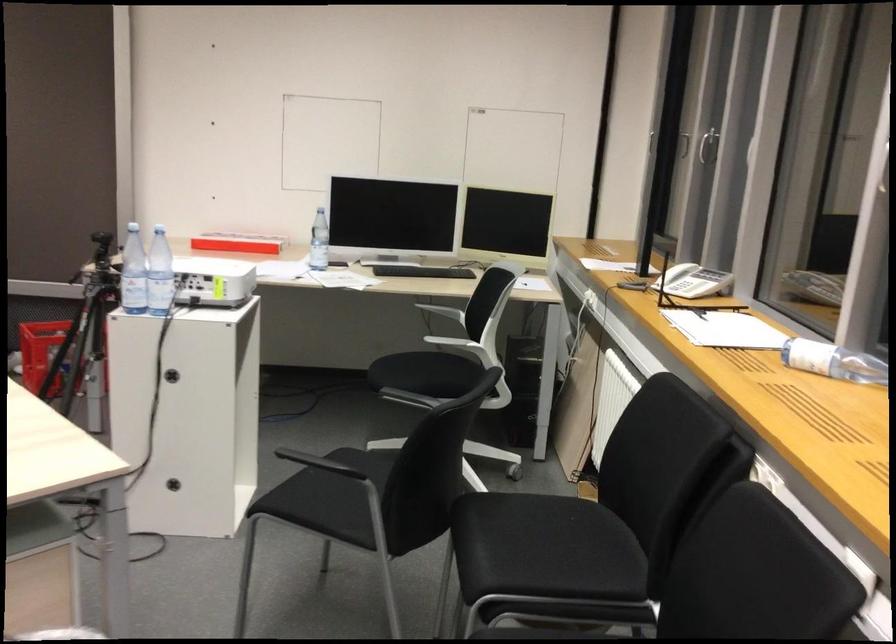
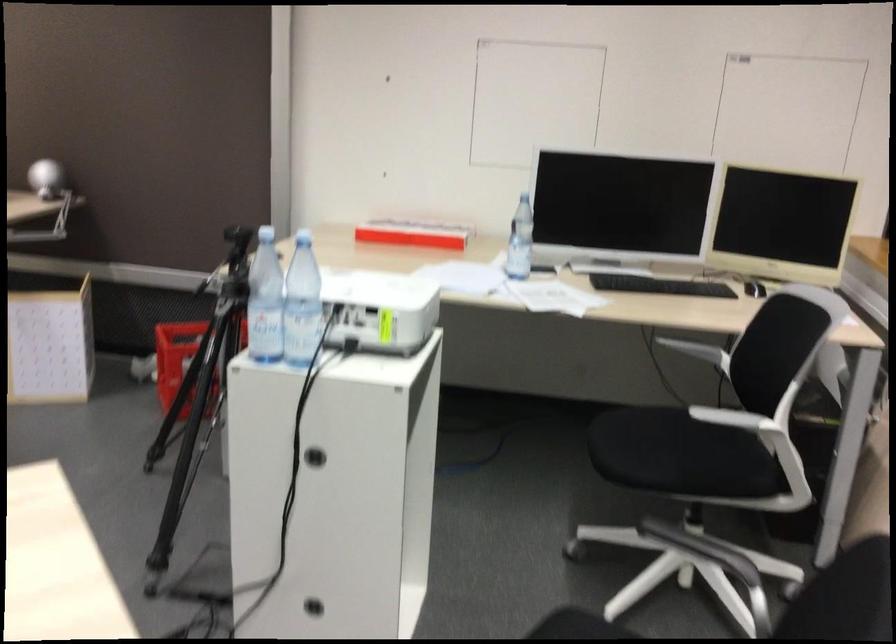
Locate, in the second image, the point that corresponds to point 171,377 in the first image.

(314, 456)